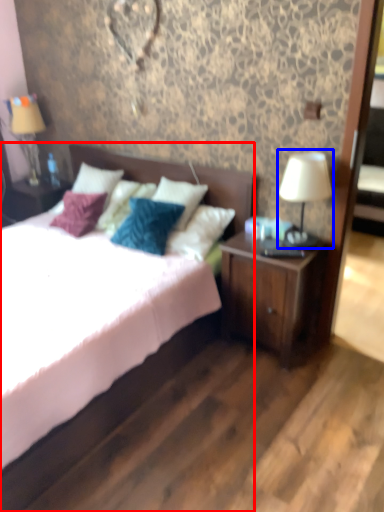
Question: Which object appears closest to the camera in this image, bed (highlighted by a red box) or table lamp (highlighted by a blue box)?

Choices:
 (A) bed
 (B) table lamp

Answer: (A)